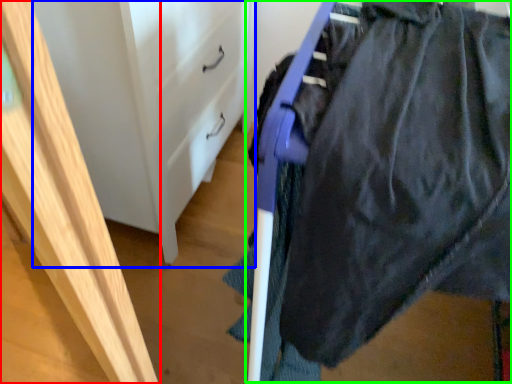
Question: Which object is the farthest from furniture (highlighted by a red box)? Choose among these: file cabinet (highlighted by a blue box) or wide (highlighted by a green box).

Choices:
 (A) file cabinet
 (B) wide

Answer: (A)